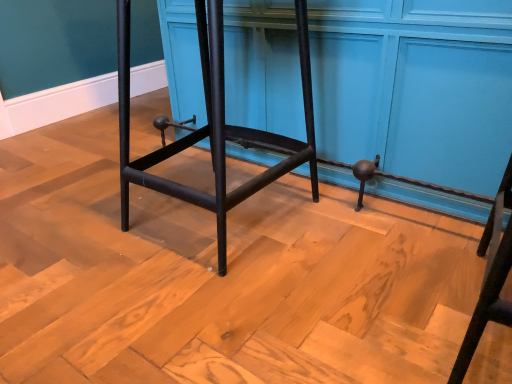
At what (x,y) coordinates should I click in order to perform the action: click on vacant area situated to the left side of black metal stool at center. Please return your answer as a coordinate pair (x, y). This screenshot has width=512, height=384. Looking at the image, I should click on (73, 220).